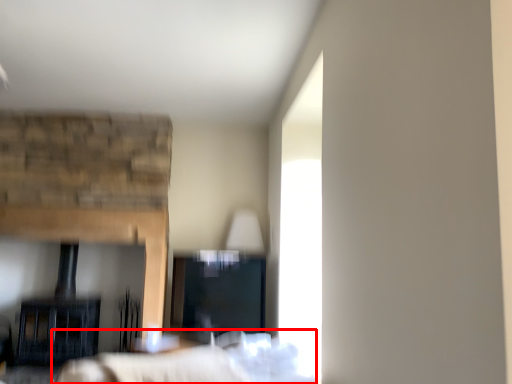
Question: From the image's perspective, where is bed (annotated by the red box) located in relation to fireplace in the image?

Choices:
 (A) below
 (B) above

Answer: (B)